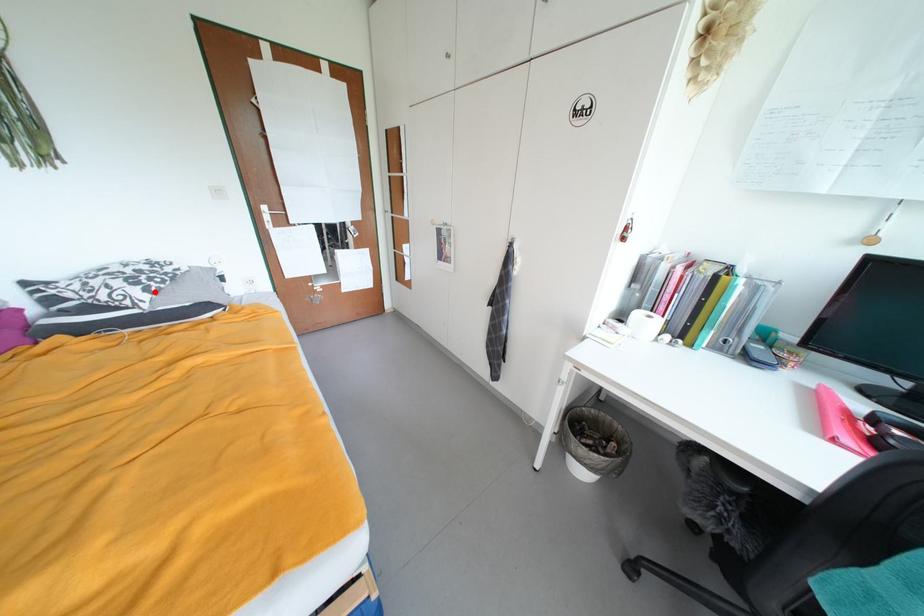
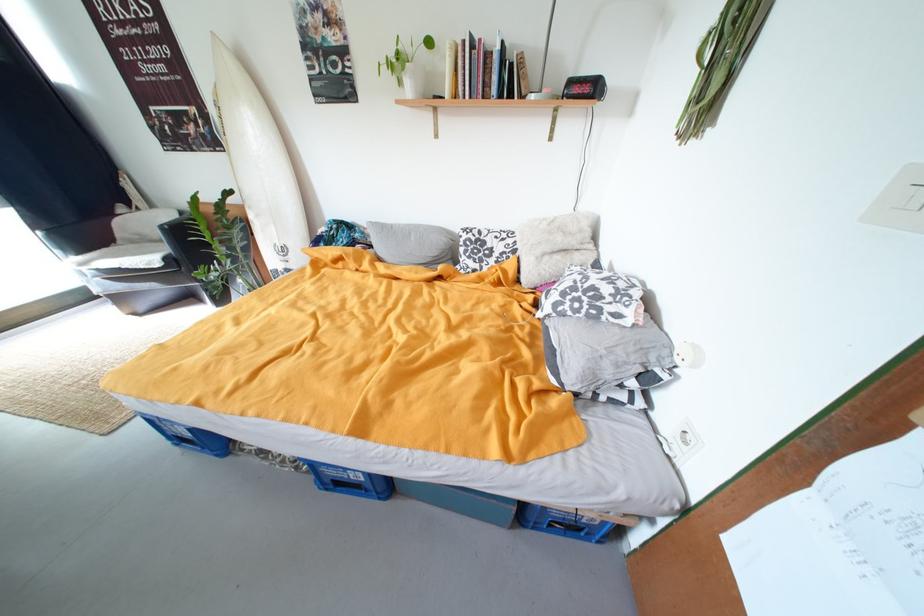
Locate, in the second image, the point that corresponds to the highlighted location in the first image.

(564, 306)